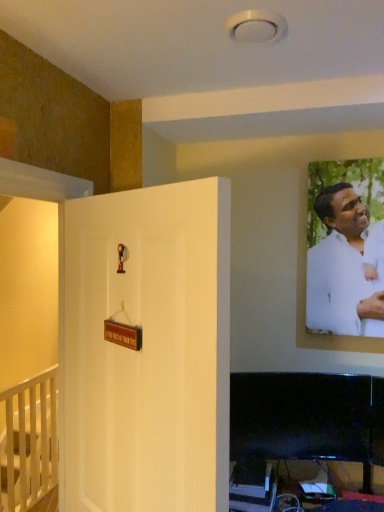
Question: From the image's perspective, is white wooden railing at lower left, arranged as the first furniture when ordered from the bottom, above or below white matte shirt at upper right?

Choices:
 (A) above
 (B) below

Answer: (B)

Question: Is white wooden railing at lower left, marked as the second furniture in a front-to-back arrangement, bigger or smaller than white matte shirt at upper right?

Choices:
 (A) small
 (B) big

Answer: (B)

Question: Based on their relative distances, which object is nearer to the white wooden railing at lower left, which is the 2th furniture from right to left?

Choices:
 (A) white matte door at center
 (B) black glossy tv at lower right, marked as the 2th furniture in a left-to-right arrangement
 (C) white matte shirt at upper right

Answer: (B)

Question: Which of these objects is positioned farthest from the white matte shirt at upper right?

Choices:
 (A) white wooden railing at lower left, which is the 2th furniture from right to left
 (B) black glossy tv at lower right, which is the 1th furniture in top-to-bottom order
 (C) white matte door at center

Answer: (A)